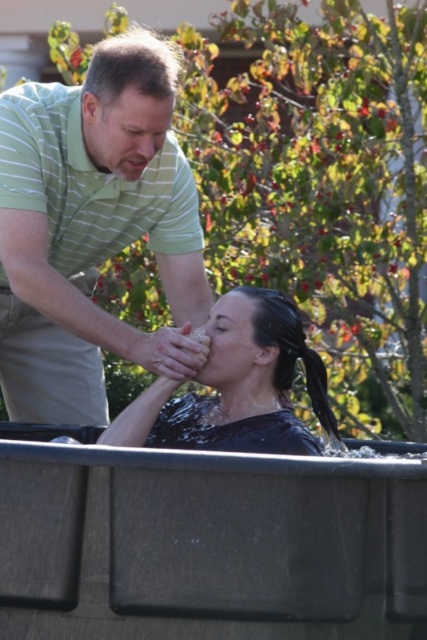
Is smooth skin hand at upper center taller than matte green forehead at upper left?

Correct, smooth skin hand at upper center is much taller as matte green forehead at upper left.

Does smooth skin hand at upper center appear under matte green forehead at upper left?

Indeed, smooth skin hand at upper center is positioned under matte green forehead at upper left.

Does point (160, 353) come in front of point (128, 99)?

Yes.

Identify the location of smooth skin hand at upper center. The width and height of the screenshot is (427, 640). (167, 352).

Between black shiny hair at upper center and smooth skin forehead at upper center, which one has more height?

black shiny hair at upper center is taller.

Can you confirm if black shiny hair at upper center is taller than smooth skin forehead at upper center?

Yes.

Who is more distant from viewer, (319, 417) or (237, 300)?

The point (319, 417) is more distant.

Where is `black shiny hair at upper center`? The width and height of the screenshot is (427, 640). black shiny hair at upper center is located at coordinates (318, 392).

Between green striped polo shirt at upper left and black shiny hair at upper center, which one has more height?

green striped polo shirt at upper left is taller.

Is the position of green striped polo shirt at upper left less distant than that of black shiny hair at upper center?

No.

Locate an element on the screen. This screenshot has width=427, height=640. green striped polo shirt at upper left is located at coordinates (88, 182).